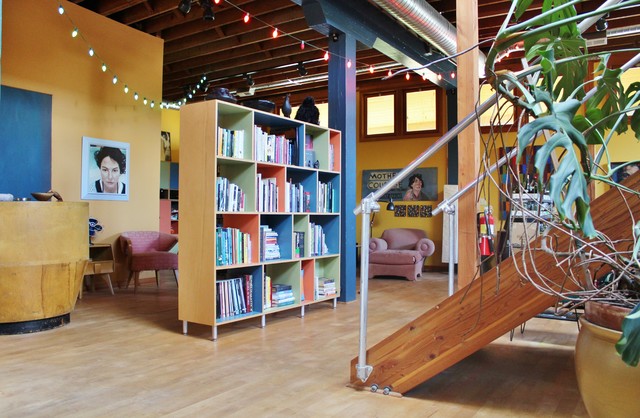
Find the location of `side of stairs`. side of stairs is located at coordinates (483, 294).